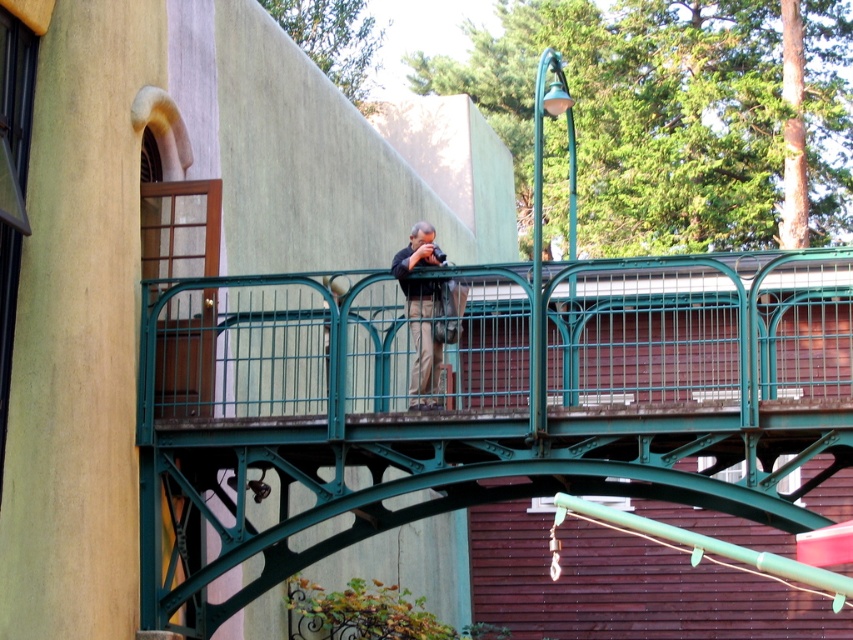
You are a drone operator trying to capture a photo of the green metal bridge at center. The drone is currently at point A and needs to fly to the bridge. Based on the coordinates provided in the description, can you determine the direction the drone should fly to reach the bridge?

The green metal bridge at center is located at point [474,403]. Since coordinates typically represent positions on a grid where higher x values mean right and higher y values mean up, the drone should fly towards the right and slightly upwards to reach the bridge.

You are a photographer standing on the green metal bridge at center holding the black fabric camera at center. You want to take a photo of the building to the left. Since the bridge is in the way, you need to move to the side. Which side should you move to so that the bridge doesn not block the view of the building?

The green metal bridge at center is bigger than the black fabric camera at center, so you should move to the left side to avoid the bridge blocking the view of the building.